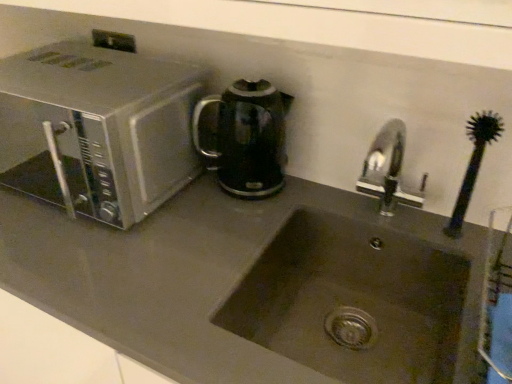
Question: From a real-world perspective, is metallic stainless steel at upper left on top of black glossy electric kettle at center?

Choices:
 (A) yes
 (B) no

Answer: (A)

Question: Is metallic stainless steel at upper left further to camera compared to black glossy electric kettle at center?

Choices:
 (A) no
 (B) yes

Answer: (A)

Question: From a real-world perspective, is metallic stainless steel at upper left physically below black glossy electric kettle at center?

Choices:
 (A) no
 (B) yes

Answer: (A)

Question: Can you confirm if metallic stainless steel at upper left is taller than black glossy electric kettle at center?

Choices:
 (A) yes
 (B) no

Answer: (B)

Question: Is metallic stainless steel at upper left positioned beyond the bounds of black glossy electric kettle at center?

Choices:
 (A) no
 (B) yes

Answer: (B)

Question: In terms of width, does metallic stainless steel at upper left look wider or thinner when compared to black glossy electric kettle at center?

Choices:
 (A) thin
 (B) wide

Answer: (B)

Question: From a real-world perspective, is metallic stainless steel at upper left physically located above or below black glossy electric kettle at center?

Choices:
 (A) above
 (B) below

Answer: (A)

Question: Based on their positions, is metallic stainless steel at upper left located to the left or right of black glossy electric kettle at center?

Choices:
 (A) right
 (B) left

Answer: (B)

Question: From the image's perspective, is metallic stainless steel at upper left located above or below black glossy electric kettle at center?

Choices:
 (A) above
 (B) below

Answer: (A)

Question: From the image's perspective, is metallic stainless steel at upper left positioned above or below matte stainless steel sink at center?

Choices:
 (A) below
 (B) above

Answer: (B)

Question: From a real-world perspective, is metallic stainless steel at upper left physically located above or below matte stainless steel sink at center?

Choices:
 (A) below
 (B) above

Answer: (B)

Question: In the image, is metallic stainless steel at upper left on the left side or the right side of matte stainless steel sink at center?

Choices:
 (A) left
 (B) right

Answer: (A)

Question: Is metallic stainless steel at upper left taller or shorter than matte stainless steel sink at center?

Choices:
 (A) tall
 (B) short

Answer: (B)

Question: From a real-world perspective, is silver metallic microwave at left above or below slate gray stone sink at center?

Choices:
 (A) above
 (B) below

Answer: (A)

Question: Is point (64, 79) positioned closer to the camera than point (350, 228)?

Choices:
 (A) closer
 (B) farther

Answer: (A)